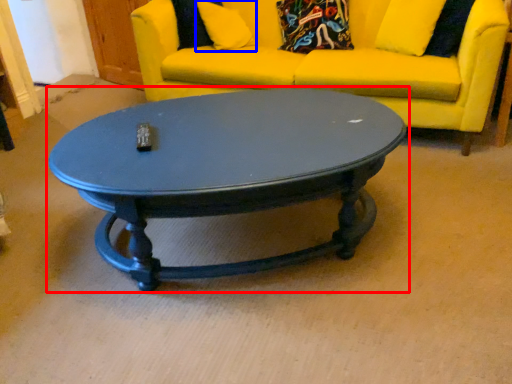
Question: Which of the following is the closest to the observer, coffee table (highlighted by a red box) or pillow (highlighted by a blue box)?

Choices:
 (A) coffee table
 (B) pillow

Answer: (A)